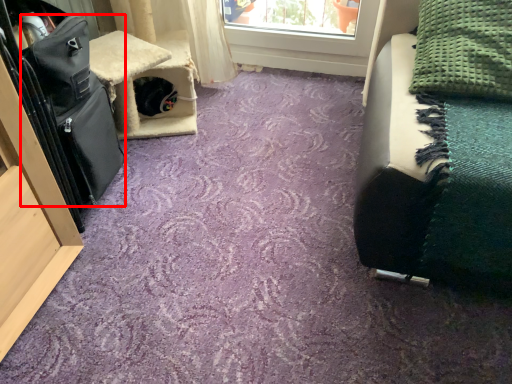
Question: Where is luggage (annotated by the red box) located in relation to blanket in the image?

Choices:
 (A) right
 (B) left

Answer: (B)